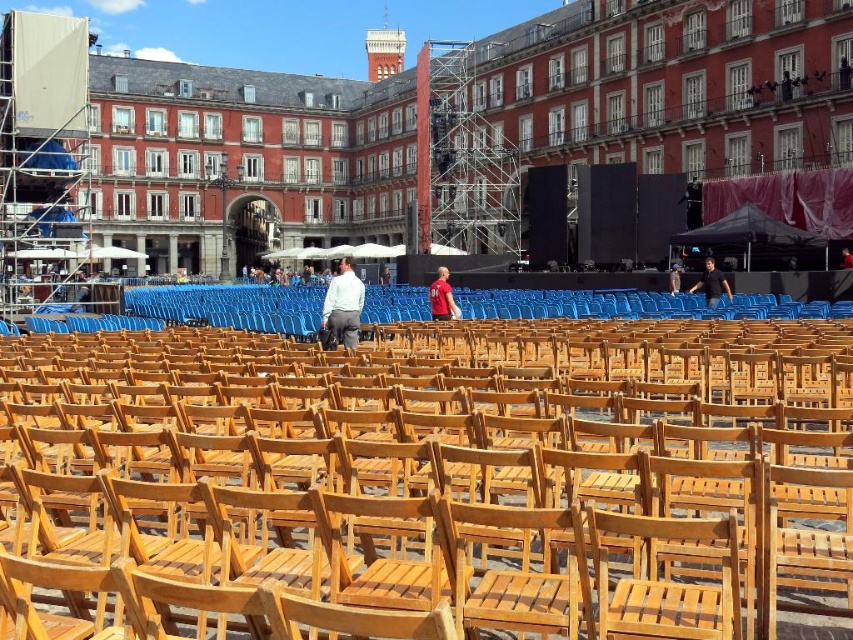
You are an event organizer who needs to ensure that all attendees can see the stage clearly. Given that the light blue shirt at center and the brown wooden chair at center are both in the central area, which object is more likely to obstruct the view of someone sitting behind it?

The light blue shirt at center is bigger than the brown wooden chair at center, so it is more likely to obstruct the view of someone sitting behind it.

You are attending a public event in the square and notice two people wearing shirts of different colors. The light blue shirt at center and the dark blue shirt at center. From your perspective facing the stage, which shirt is positioned to the left?

The light blue shirt at center is to the left of the dark blue shirt at center.

You are attending an event in the square and notice two people wearing shirts of different colors. One is wearing a light blue shirt at center and the other a dark blue shirt at center. From your perspective, which shirt is closer to you?

The light blue shirt at center is closer to you because it is in front of the dark blue shirt at center.